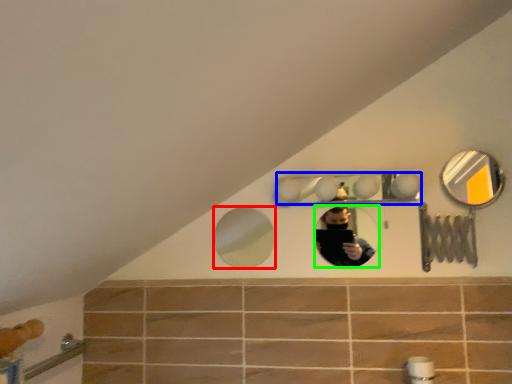
Question: Based on their relative distances, which object is farther from mirror (highlighted by a red box)? Choose from mirror (highlighted by a blue box) and mirror (highlighted by a green box).

Choices:
 (A) mirror
 (B) mirror

Answer: (A)